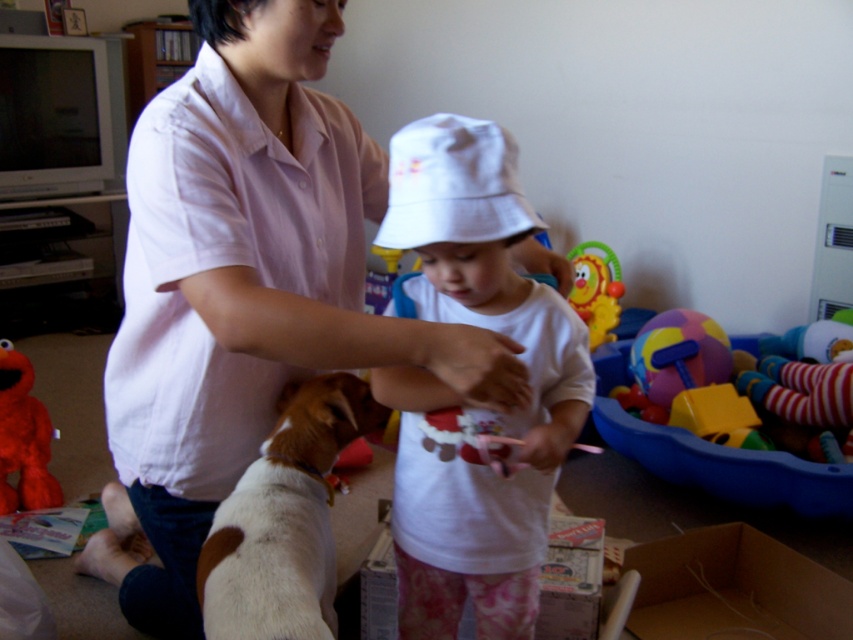
You are a child in the playroom and want to grab the closest toy to you. Which one would you choose between the fluffy plush toy at left and the plastic yellow lion at center?

The fluffy plush toy at left is closer to the viewer than the plastic yellow lion at center, so you should grab the fluffy plush toy at left.

You are organizing a toy storage box and need to place the white cotton hat at center and the plastic yellow lion at center inside. Based on their sizes, which one should you place first to ensure both fit properly?

Since the white cotton hat at center might be wider than the plastic yellow lion at center, you should place the wider white cotton hat at center first to make space for the smaller plastic yellow lion at center.

You are a parent in the room and want to hand your child the fluffy plush toy at left. You are currently standing 5 feet away from the toy. Can you reach it without moving?

The fluffy plush toy at left is 7.86 feet away from the viewer. Since you are 5 feet away from it, you cannot reach it without moving closer.